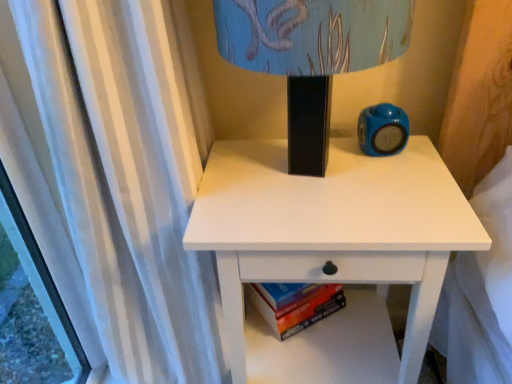
You are a GUI agent. You are given a task and a screenshot of the screen. Output one action in this format:
    pyautogui.click(x=<x>, y=<y>)
    Task: Click on the free space above white matte nightstand at center (from a real-world perspective)
    The image size is (512, 384).
    Given the screenshot: What is the action you would take?
    pyautogui.click(x=322, y=189)